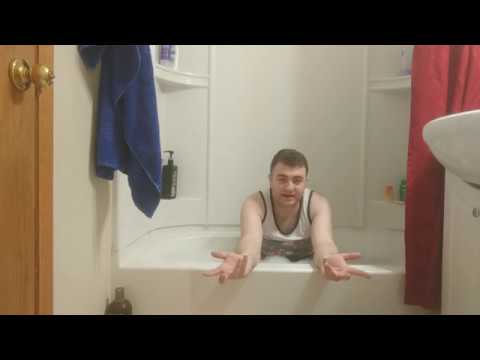
The height and width of the screenshot is (360, 480). Find the location of `sink`. sink is located at coordinates (466, 130).